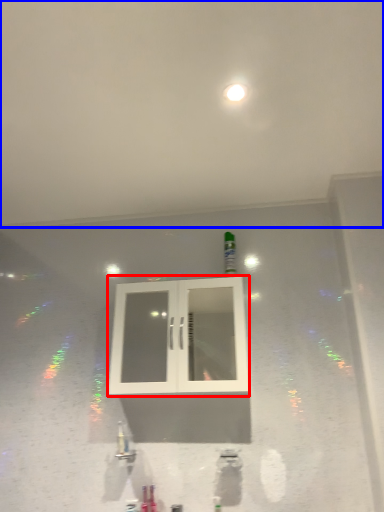
Question: Which of the following is the farthest to the observer, window (highlighted by a red box) or backdrop (highlighted by a blue box)?

Choices:
 (A) window
 (B) backdrop

Answer: (A)